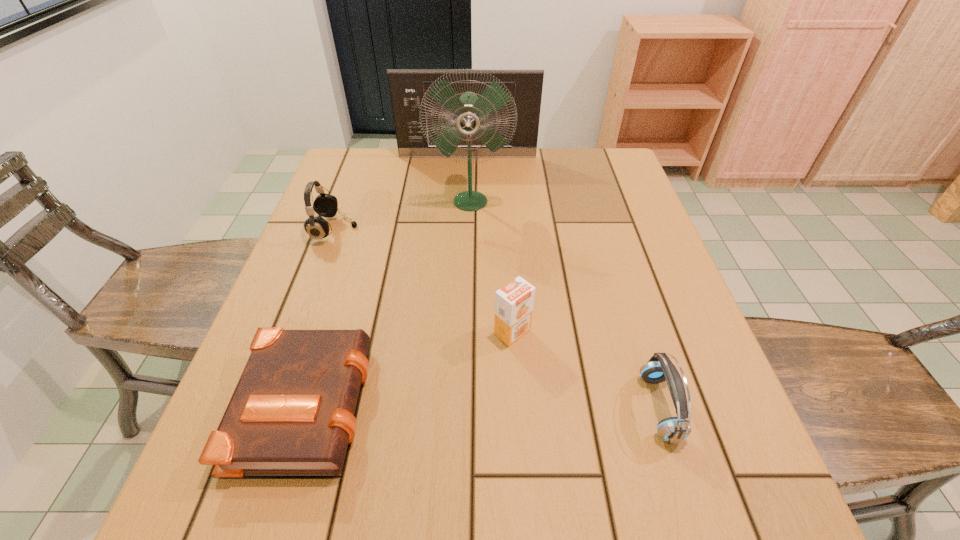
Identify the location of vacant space that satisfies the following two spatial constraints: 1. on the front-facing side of the tallest object; 2. with the microphone on the side of the left headset. This screenshot has width=960, height=540. (469, 230).

This screenshot has width=960, height=540. What are the coordinates of `vacant space that satisfies the following two spatial constraints: 1. on the front-facing side of the tallest object; 2. with the microphone on the side of the taller headset` in the screenshot? It's located at (469, 230).

This screenshot has height=540, width=960. I want to click on vacant area that satisfies the following two spatial constraints: 1. on the front-facing side of the fan; 2. on the spine side of the Bible, so click(x=466, y=400).

Locate an element on the screen. Image resolution: width=960 pixels, height=540 pixels. free region that satisfies the following two spatial constraints: 1. with the microphone on the side of the left headset; 2. on the left side of the orange juice is located at coordinates (298, 332).